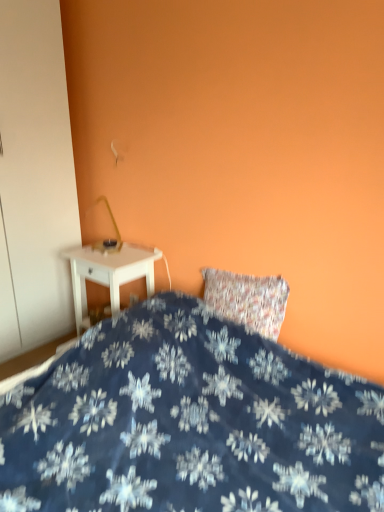
In order to click on free space above white glossy nightstand at left (from a real-world perspective) in this screenshot , I will do `click(113, 250)`.